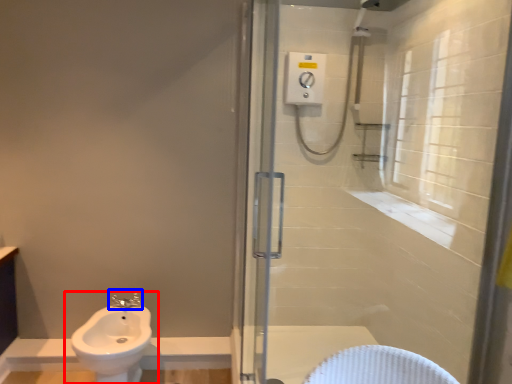
Question: Which point is closer to the camera, sink (highlighted by a red box) or tap (highlighted by a blue box)?

Choices:
 (A) sink
 (B) tap

Answer: (A)